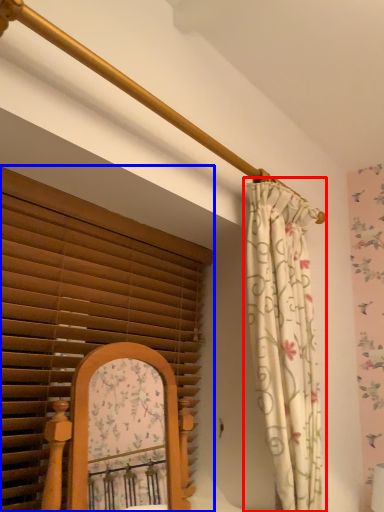
Question: Which object is closer to the camera taking this photo, curtain (highlighted by a red box) or window blind (highlighted by a blue box)?

Choices:
 (A) curtain
 (B) window blind

Answer: (B)